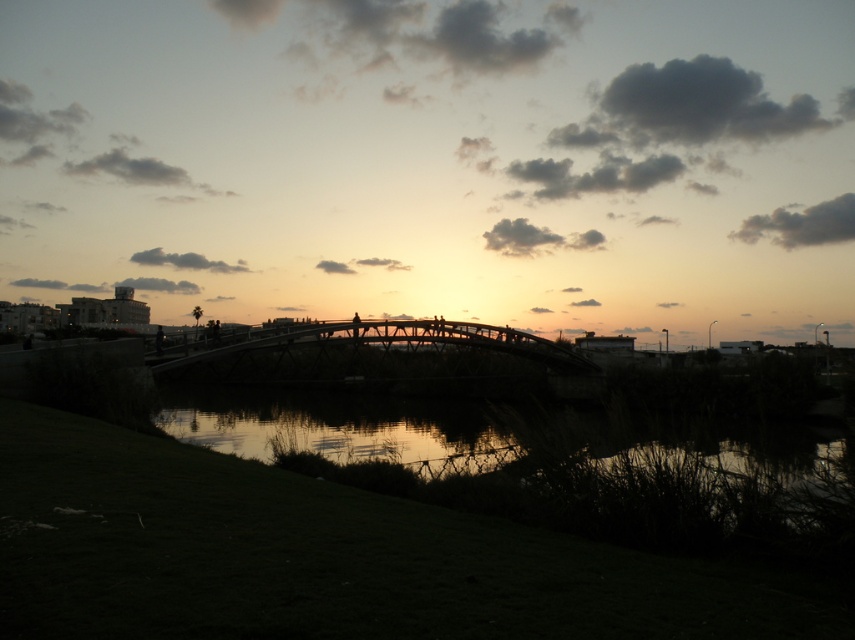
You are standing on the grassy embankment in the foreground and want to walk towards the bridge. There are two points marked on the path ahead of you. The first is point (275, 428) and the second is point (209, 371). Which point should you reach first to stay on the path towards the bridge?

You should reach point (275, 428) first because it is in front of point (209, 371), so following them in order will keep you on the path towards the bridge.

You are an artist planning to paint the sunset scene. You want to emphasize the silvery reflective water at center and the wooden bridge at center. Which object should you paint first if you want to focus on the larger one first?

The silvery reflective water at center has a larger size compared to wooden bridge at center, so you should paint the silvery reflective water at center first.